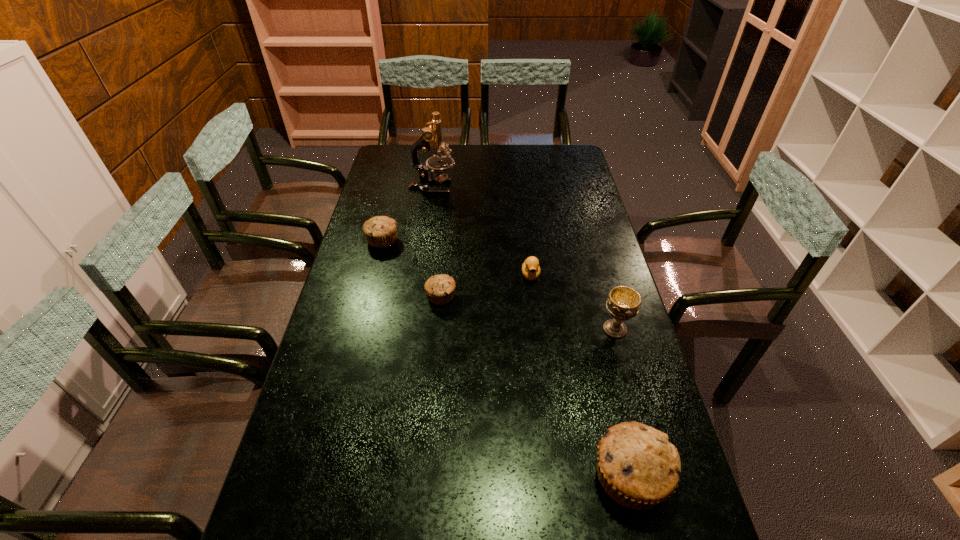
The height and width of the screenshot is (540, 960). Find the location of `the farthest muffin`. the farthest muffin is located at coordinates pos(380,231).

Locate an element on the screen. Image resolution: width=960 pixels, height=540 pixels. the second tallest muffin is located at coordinates (380, 231).

Locate an element on the screen. The height and width of the screenshot is (540, 960). the second muffin from left to right is located at coordinates (440, 288).

You are a GUI agent. You are given a task and a screenshot of the screen. Output one action in this format:
    pyautogui.click(x=<x>, y=<y>)
    Task: Click on the shortest muffin
    The height and width of the screenshot is (540, 960).
    Given the screenshot: What is the action you would take?
    pyautogui.click(x=440, y=288)

You are a GUI agent. You are given a task and a screenshot of the screen. Output one action in this format:
    pyautogui.click(x=<x>, y=<y>)
    Task: Click on the tallest muffin
    
    Given the screenshot: What is the action you would take?
    pyautogui.click(x=638, y=467)

At what (x,y) coordinates should I click in order to perform the action: click on the nearest muffin. Please return your answer as a coordinate pair (x, y). Image resolution: width=960 pixels, height=540 pixels. Looking at the image, I should click on (638, 467).

At what (x,y) coordinates should I click in order to perform the action: click on the fifth farthest object. Please return your answer as a coordinate pair (x, y). Looking at the image, I should click on (623, 303).

The width and height of the screenshot is (960, 540). What are the coordinates of `the farthest object` in the screenshot? It's located at click(431, 138).

This screenshot has width=960, height=540. I want to click on microscope, so click(x=431, y=138).

Where is `duckling`? duckling is located at coordinates (531, 270).